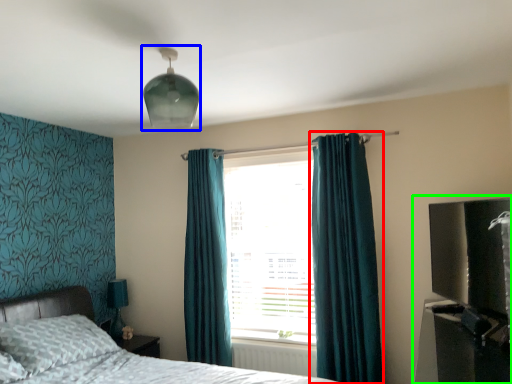
Question: Which object is the closest to the curtain (highlighted by a red box)? Choose among these: light fixture (highlighted by a blue box) or entertainment center (highlighted by a green box).

Choices:
 (A) light fixture
 (B) entertainment center

Answer: (B)